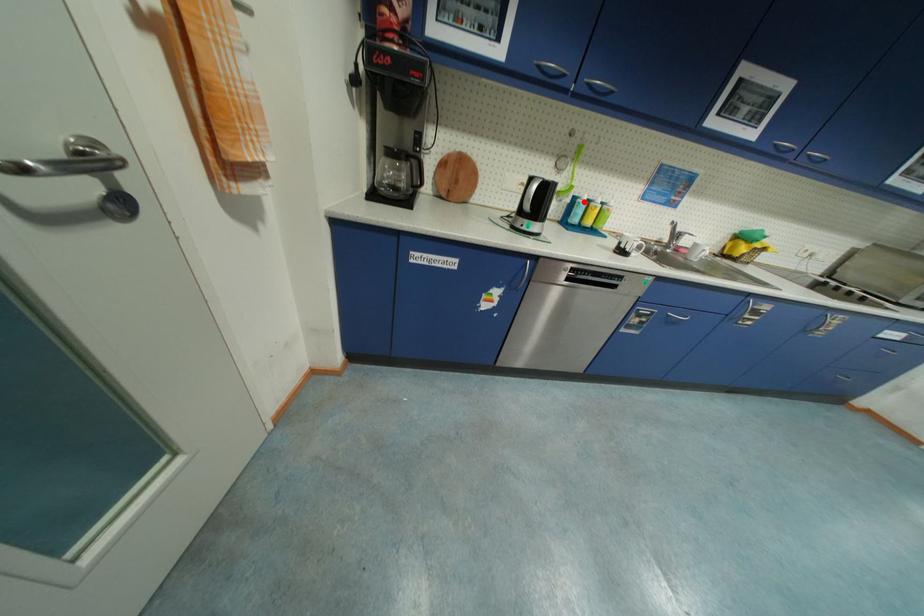
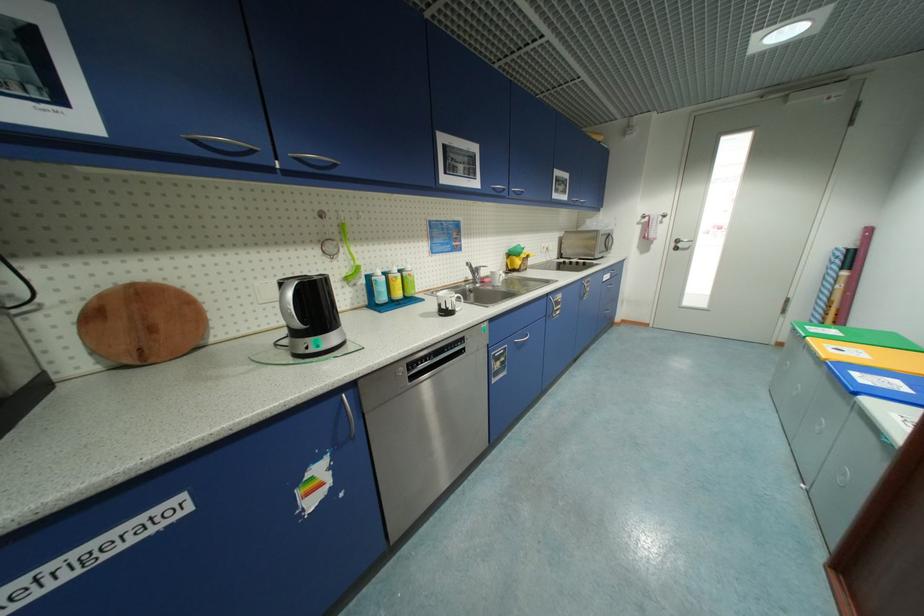
Question: A red point is marked in image1. In image2, is the corresponding 3D point closer to the camera or farther? Reply with the corresponding letter.

Choices:
 (A) The corresponding 3D point is closer.
 (B) The corresponding 3D point is farther.

Answer: (B)